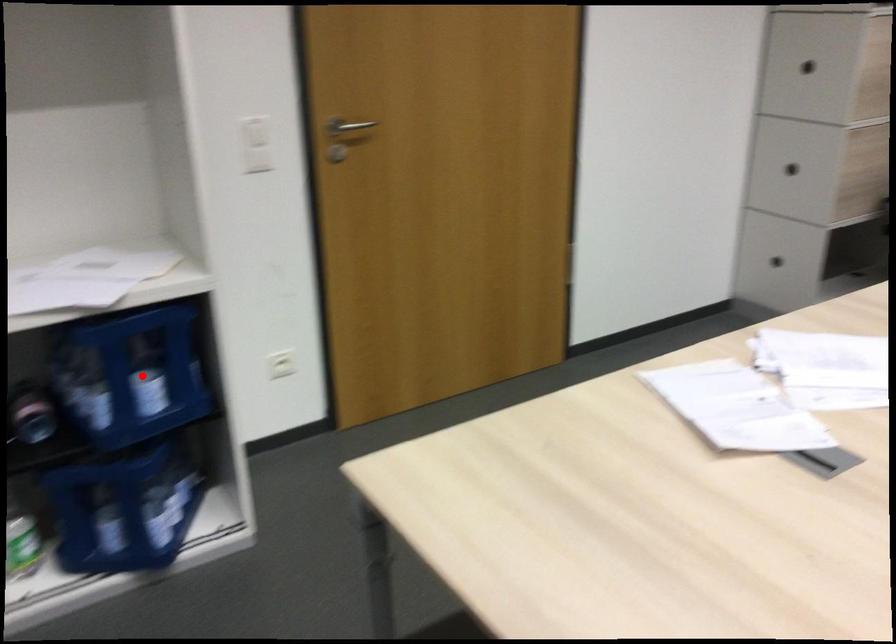
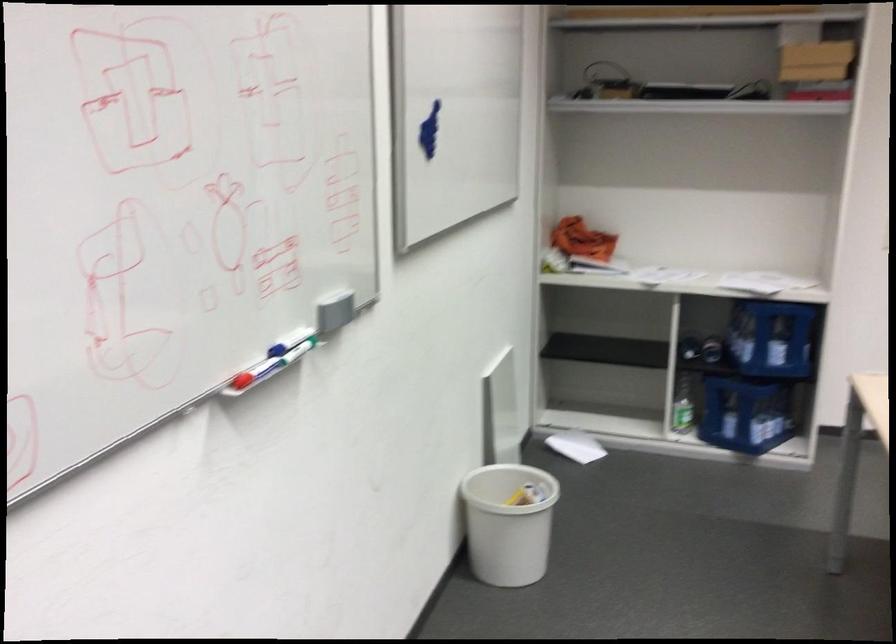
Locate, in the second image, the point that corresponds to the highlighted location in the first image.

(771, 337)